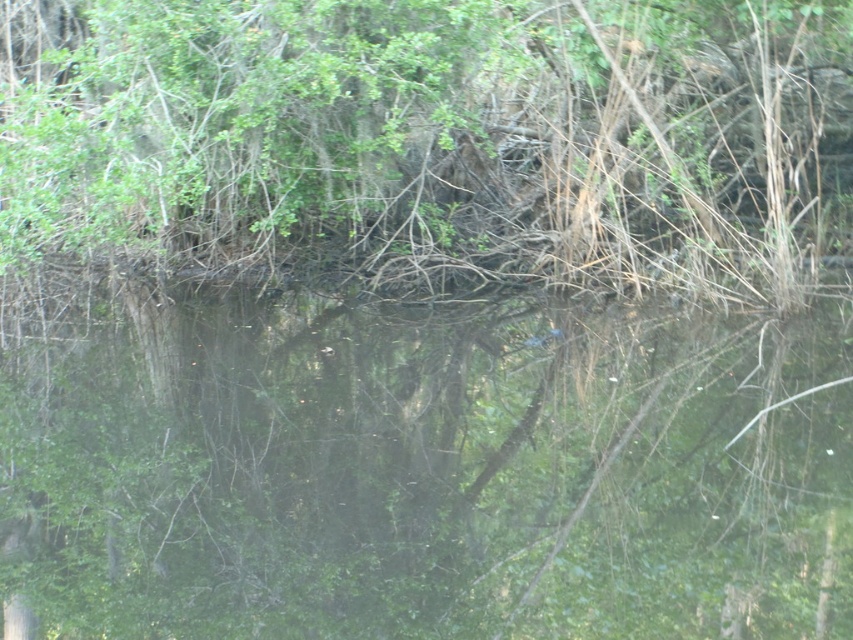
Question: Which of the following is the closest to the observer?

Choices:
 (A) green reflective water at center
 (B) green leafy tree at upper center

Answer: (A)

Question: Which of the following is the farthest from the observer?

Choices:
 (A) (x=714, y=198)
 (B) (x=613, y=397)

Answer: (A)

Question: Observing the image, what is the correct spatial positioning of green reflective water at center in reference to green leafy tree at upper center?

Choices:
 (A) above
 (B) below

Answer: (B)

Question: Does green reflective water at center appear under green leafy tree at upper center?

Choices:
 (A) yes
 (B) no

Answer: (A)

Question: In this image, where is green reflective water at center located relative to green leafy tree at upper center?

Choices:
 (A) above
 (B) below

Answer: (B)

Question: Which object is closer to the camera taking this photo?

Choices:
 (A) green reflective water at center
 (B) green leafy tree at upper center

Answer: (A)